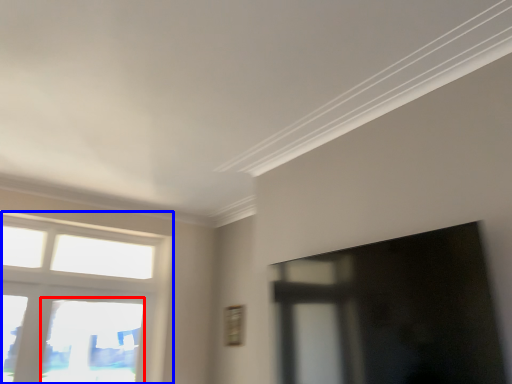
Question: Which of the following is the farthest to the observer, window (highlighted by a red box) or window (highlighted by a blue box)?

Choices:
 (A) window
 (B) window

Answer: (A)